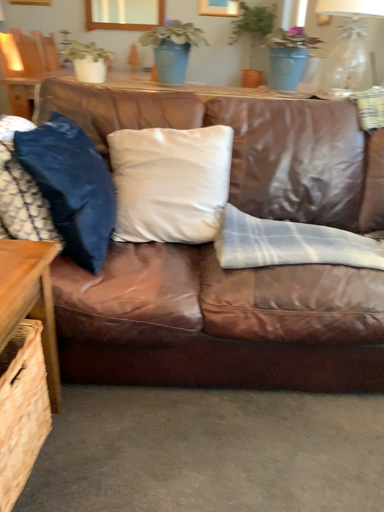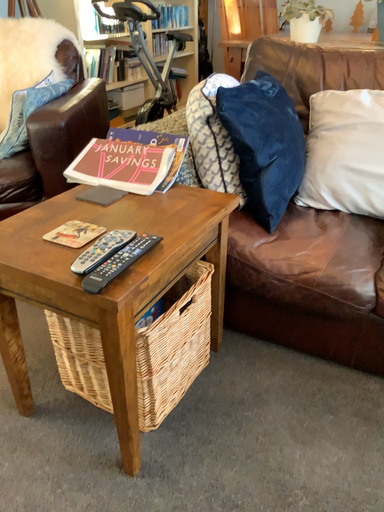
Question: Which way did the camera rotate in the video?

Choices:
 (A) rotated right
 (B) rotated left

Answer: (B)